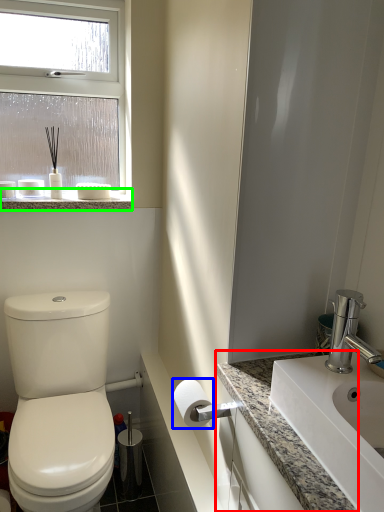
Question: Based on their relative distances, which object is nearer to counter top (highlighted by a red box)? Choose from toilet paper (highlighted by a blue box) and window sill (highlighted by a green box).

Choices:
 (A) toilet paper
 (B) window sill

Answer: (A)